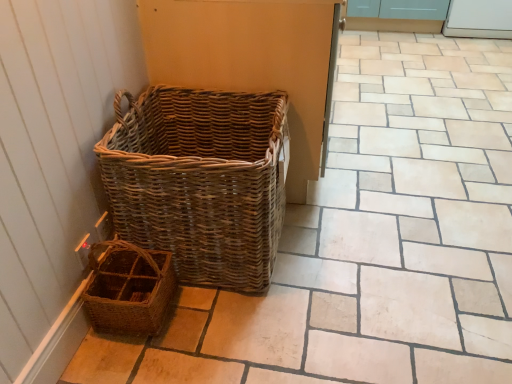
What do you see at coordinates (129, 288) in the screenshot? I see `brown woven picnic basket at lower left, acting as the 1th picnic basket starting from the bottom` at bounding box center [129, 288].

Find the location of `white glossy screen door at upper right`. white glossy screen door at upper right is located at coordinates (479, 19).

Considering the positions of objects brown woven picnic basket at lower left, the second picnic basket in the top-to-bottom sequence, and white glossy screen door at upper right in the image provided, who is more to the right, brown woven picnic basket at lower left, the second picnic basket in the top-to-bottom sequence, or white glossy screen door at upper right?

From the viewer's perspective, white glossy screen door at upper right appears more on the right side.

The image size is (512, 384). I want to click on screen door above the brown woven picnic basket at lower left, the second picnic basket in the top-to-bottom sequence (from the image's perspective), so click(x=479, y=19).

Does point (127, 258) appear closer or farther from the camera than point (463, 31)?

Point (127, 258) appears to be closer to the viewer than point (463, 31).

What's the angular difference between brown woven picnic basket at lower left, the second picnic basket in the top-to-bottom sequence, and white glossy screen door at upper right's facing directions?

The angle between the facing direction of brown woven picnic basket at lower left, the second picnic basket in the top-to-bottom sequence, and the facing direction of white glossy screen door at upper right is 93.9 degrees.

Measure the distance from natural wicker picnic basket at left, which is the first picnic basket in top-to-bottom order, to white glossy screen door at upper right.

natural wicker picnic basket at left, which is the first picnic basket in top-to-bottom order, is 3.33 meters away from white glossy screen door at upper right.

From a real-world perspective, is natural wicker picnic basket at left, which is the first picnic basket in top-to-bottom order, located beneath white glossy screen door at upper right?

No, from a real-world perspective, natural wicker picnic basket at left, which is the first picnic basket in top-to-bottom order, is not beneath white glossy screen door at upper right.

Does natural wicker picnic basket at left, placed as the second picnic basket when sorted from bottom to top, have a larger size compared to white glossy screen door at upper right?

Yes, natural wicker picnic basket at left, placed as the second picnic basket when sorted from bottom to top, is bigger than white glossy screen door at upper right.

Is natural wicker picnic basket at left, placed as the second picnic basket when sorted from bottom to top, facing towards white glossy screen door at upper right?

No, natural wicker picnic basket at left, placed as the second picnic basket when sorted from bottom to top, is not oriented towards white glossy screen door at upper right.

Which of these two, natural wicker picnic basket at left, placed as the second picnic basket when sorted from bottom to top, or brown woven picnic basket at lower left, the second picnic basket in the top-to-bottom sequence, stands shorter?

With less height is brown woven picnic basket at lower left, the second picnic basket in the top-to-bottom sequence.

Does natural wicker picnic basket at left, placed as the second picnic basket when sorted from bottom to top, have a larger size compared to brown woven picnic basket at lower left, acting as the 1th picnic basket starting from the bottom?

Correct, natural wicker picnic basket at left, placed as the second picnic basket when sorted from bottom to top, is larger in size than brown woven picnic basket at lower left, acting as the 1th picnic basket starting from the bottom.

Is natural wicker picnic basket at left, which is the first picnic basket in top-to-bottom order, to the left of brown woven picnic basket at lower left, the second picnic basket in the top-to-bottom sequence, from the viewer's perspective?

No, natural wicker picnic basket at left, which is the first picnic basket in top-to-bottom order, is not to the left of brown woven picnic basket at lower left, the second picnic basket in the top-to-bottom sequence.

Does brown woven picnic basket at lower left, acting as the 1th picnic basket starting from the bottom, have a greater height compared to natural wicker picnic basket at left, which is the first picnic basket in top-to-bottom order?

No.

From a real-world perspective, is brown woven picnic basket at lower left, the second picnic basket in the top-to-bottom sequence, beneath natural wicker picnic basket at left, which is the first picnic basket in top-to-bottom order?

Yes, from a real-world perspective, brown woven picnic basket at lower left, the second picnic basket in the top-to-bottom sequence, is beneath natural wicker picnic basket at left, which is the first picnic basket in top-to-bottom order.

Is brown woven picnic basket at lower left, the second picnic basket in the top-to-bottom sequence, in contact with natural wicker picnic basket at left, placed as the second picnic basket when sorted from bottom to top?

No.

Is brown woven picnic basket at lower left, the second picnic basket in the top-to-bottom sequence, positioned before natural wicker picnic basket at left, placed as the second picnic basket when sorted from bottom to top?

No, brown woven picnic basket at lower left, the second picnic basket in the top-to-bottom sequence, is further to the viewer.

Is white glossy screen door at upper right facing away from brown woven picnic basket at lower left, the second picnic basket in the top-to-bottom sequence?

white glossy screen door at upper right is not turned away from brown woven picnic basket at lower left, the second picnic basket in the top-to-bottom sequence.

Considering the sizes of objects white glossy screen door at upper right and brown woven picnic basket at lower left, acting as the 1th picnic basket starting from the bottom, in the image provided, who is thinner, white glossy screen door at upper right or brown woven picnic basket at lower left, acting as the 1th picnic basket starting from the bottom,?

brown woven picnic basket at lower left, acting as the 1th picnic basket starting from the bottom, is thinner.

Which is more distant, (x=449, y=17) or (x=103, y=263)?

The point (x=449, y=17) is more distant.

From a real-world perspective, is white glossy screen door at upper right on top of brown woven picnic basket at lower left, acting as the 1th picnic basket starting from the bottom?

Correct, in the physical world, white glossy screen door at upper right is higher than brown woven picnic basket at lower left, acting as the 1th picnic basket starting from the bottom.

Considering the relative sizes of white glossy screen door at upper right and natural wicker picnic basket at left, placed as the second picnic basket when sorted from bottom to top, in the image provided, is white glossy screen door at upper right bigger than natural wicker picnic basket at left, placed as the second picnic basket when sorted from bottom to top,?

No.

Is point (453, 32) positioned behind point (233, 167)?

Yes, point (453, 32) is farther from viewer.

From the image's perspective, which object appears higher, white glossy screen door at upper right or natural wicker picnic basket at left, which is the first picnic basket in top-to-bottom order?

white glossy screen door at upper right.

Who is more distant, white glossy screen door at upper right or natural wicker picnic basket at left, placed as the second picnic basket when sorted from bottom to top?

white glossy screen door at upper right is further from the camera.

Locate an element on the screen. The width and height of the screenshot is (512, 384). the 1st picnic basket in front of the white glossy screen door at upper right, starting your count from the anchor is located at coordinates (129, 288).

At what (x,y) coordinates should I click in order to perform the action: click on picnic basket above the white glossy screen door at upper right (from a real-world perspective). Please return your answer as a coordinate pair (x, y). Image resolution: width=512 pixels, height=384 pixels. Looking at the image, I should click on (200, 181).

Estimate the real-world distances between objects in this image. Which object is closer to natural wicker picnic basket at left, placed as the second picnic basket when sorted from bottom to top, white glossy screen door at upper right or brown woven picnic basket at lower left, acting as the 1th picnic basket starting from the bottom?

brown woven picnic basket at lower left, acting as the 1th picnic basket starting from the bottom, lies closer to natural wicker picnic basket at left, placed as the second picnic basket when sorted from bottom to top, than the other object.

Estimate the real-world distances between objects in this image. Which object is further from brown woven picnic basket at lower left, acting as the 1th picnic basket starting from the bottom, white glossy screen door at upper right or natural wicker picnic basket at left, placed as the second picnic basket when sorted from bottom to top?

white glossy screen door at upper right lies further to brown woven picnic basket at lower left, acting as the 1th picnic basket starting from the bottom, than the other object.

Which object lies further to the anchor point white glossy screen door at upper right, brown woven picnic basket at lower left, the second picnic basket in the top-to-bottom sequence, or natural wicker picnic basket at left, which is the first picnic basket in top-to-bottom order?

brown woven picnic basket at lower left, the second picnic basket in the top-to-bottom sequence.

Based on their spatial positions, is natural wicker picnic basket at left, placed as the second picnic basket when sorted from bottom to top, or white glossy screen door at upper right closer to brown woven picnic basket at lower left, acting as the 1th picnic basket starting from the bottom?

natural wicker picnic basket at left, placed as the second picnic basket when sorted from bottom to top.

Looking at the image, which one is located further to natural wicker picnic basket at left, which is the first picnic basket in top-to-bottom order, brown woven picnic basket at lower left, acting as the 1th picnic basket starting from the bottom, or white glossy screen door at upper right?

The object further to natural wicker picnic basket at left, which is the first picnic basket in top-to-bottom order, is white glossy screen door at upper right.

Based on their spatial positions, is natural wicker picnic basket at left, which is the first picnic basket in top-to-bottom order, or brown woven picnic basket at lower left, the second picnic basket in the top-to-bottom sequence, further from white glossy screen door at upper right?

brown woven picnic basket at lower left, the second picnic basket in the top-to-bottom sequence, is further to white glossy screen door at upper right.

The height and width of the screenshot is (384, 512). I want to click on picnic basket between brown woven picnic basket at lower left, acting as the 1th picnic basket starting from the bottom, and white glossy screen door at upper right, in the horizontal direction, so click(x=200, y=181).